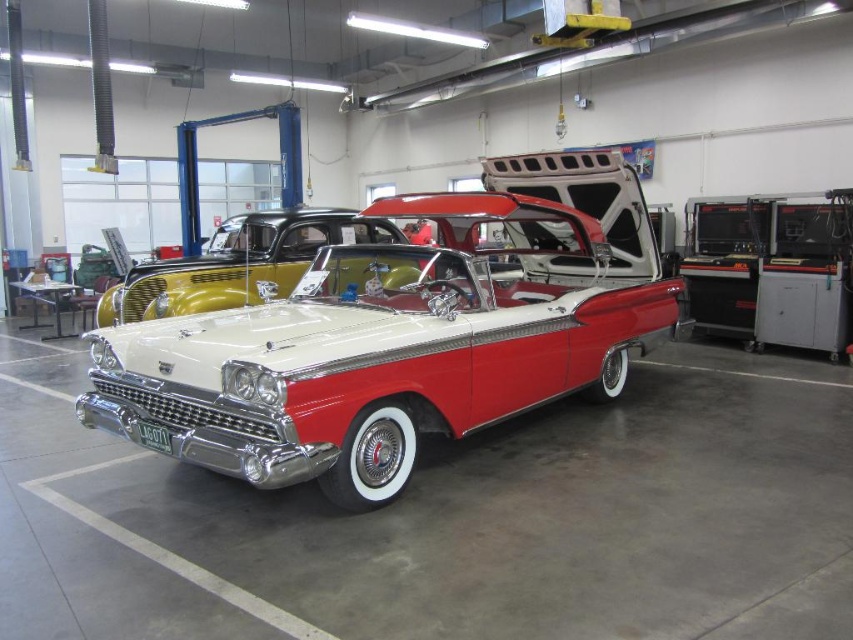
Is the position of shiny chrome car at center more distant than that of shiny chrome grill at center?

No, shiny chrome car at center is closer to the viewer.

Does shiny chrome car at center appear under shiny chrome grill at center?

Yes.

Find the location of a particular element. shiny chrome car at center is located at coordinates (402, 337).